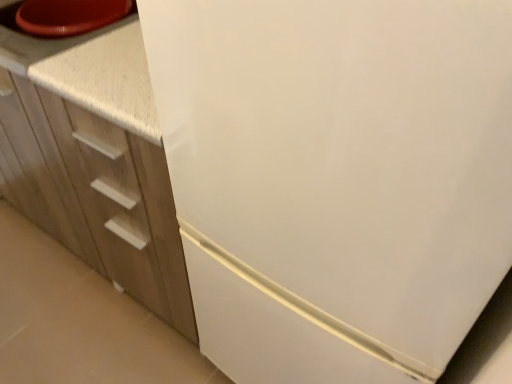
Question: Which is correct: white speckled countertop at upper left is inside white matte cabinet at left, or outside of it?

Choices:
 (A) outside
 (B) inside

Answer: (B)

Question: Considering the positions of white speckled countertop at upper left and white matte cabinet at left in the image, is white speckled countertop at upper left bigger or smaller than white matte cabinet at left?

Choices:
 (A) small
 (B) big

Answer: (A)

Question: Is white speckled countertop at upper left wider or thinner than white matte cabinet at left?

Choices:
 (A) wide
 (B) thin

Answer: (B)

Question: Is point (184, 307) closer or farther from the camera than point (37, 81)?

Choices:
 (A) farther
 (B) closer

Answer: (A)

Question: From the image's perspective, is white matte cabinet at left located above or below white speckled countertop at upper left?

Choices:
 (A) above
 (B) below

Answer: (B)

Question: Considering the positions of white matte cabinet at left and white speckled countertop at upper left in the image, is white matte cabinet at left taller or shorter than white speckled countertop at upper left?

Choices:
 (A) short
 (B) tall

Answer: (B)

Question: In the image, is white matte cabinet at left positioned in front of or behind white speckled countertop at upper left?

Choices:
 (A) behind
 (B) front

Answer: (B)